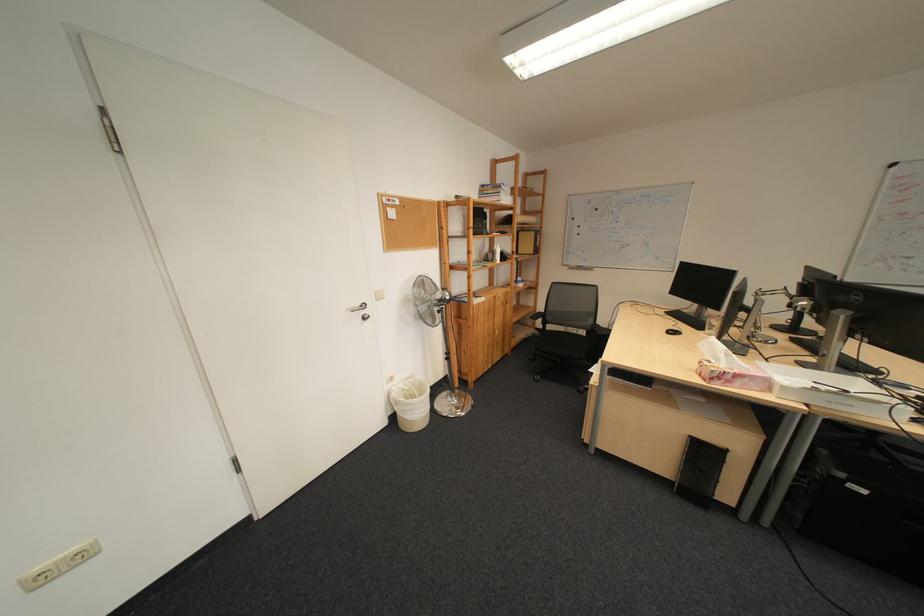
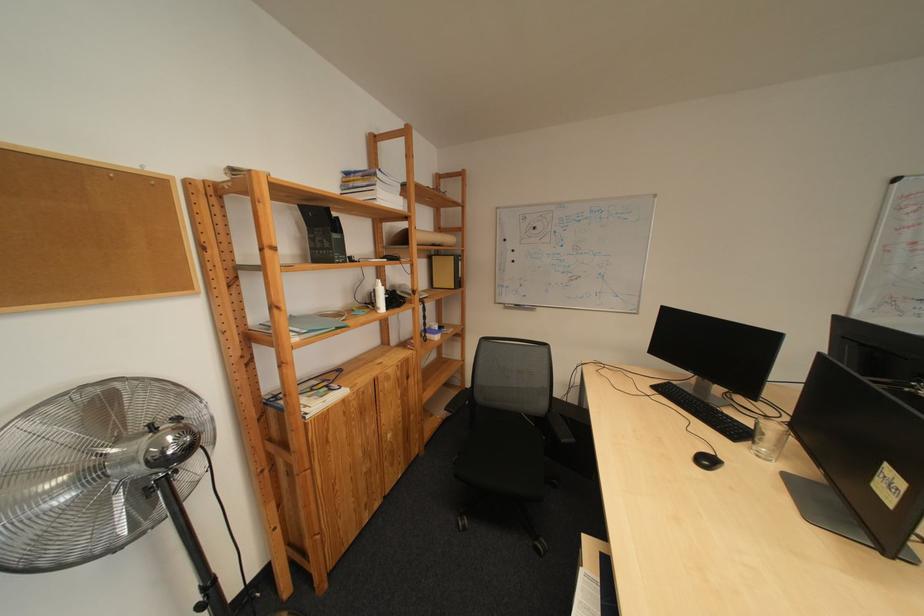
In a continuous first-person perspective shot, in which direction is the camera moving?

The cameraman walked toward right, forward.